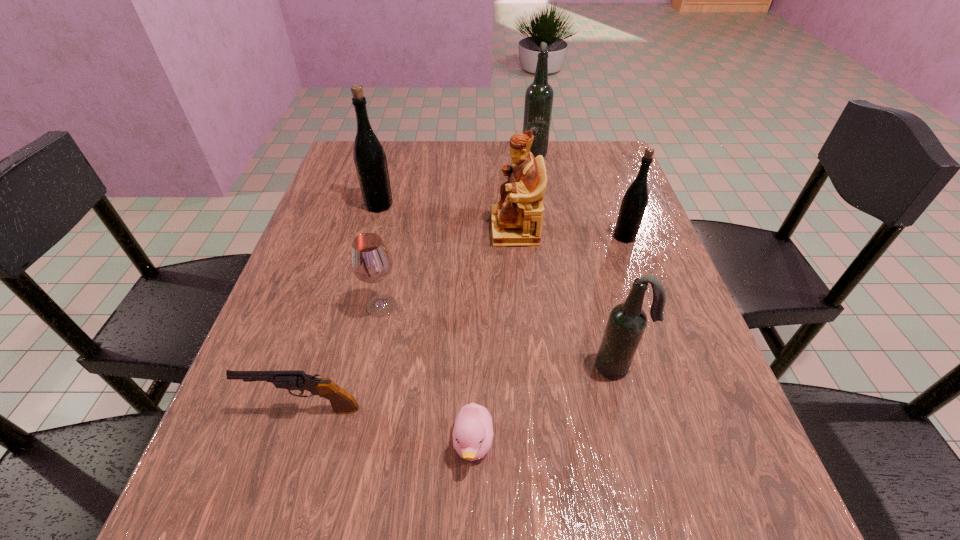
In order to click on vacant point located on the front of the rightmost beer bottle in this screenshot , I will do `click(653, 315)`.

Find the location of a particular element. Image resolution: width=960 pixels, height=540 pixels. vacant space situated on the left of the smaller dark beer bottle is located at coordinates (549, 367).

The height and width of the screenshot is (540, 960). Identify the location of free location located on the back of the fifth farthest object. (388, 275).

Locate an element on the screen. The image size is (960, 540). object located at the far edge is located at coordinates (539, 95).

Where is `beer bottle that is positioned at the left edge`? This screenshot has width=960, height=540. beer bottle that is positioned at the left edge is located at coordinates (369, 156).

Image resolution: width=960 pixels, height=540 pixels. Find the location of `gun at the left edge`. gun at the left edge is located at coordinates (342, 402).

Find the location of a particular element. The image size is (960, 540). vacant space at the far edge is located at coordinates (420, 159).

Where is `vacant area at the left edge`? This screenshot has height=540, width=960. vacant area at the left edge is located at coordinates (325, 370).

In the image, there is a desktop. Identify the location of vacant space at the right edge. The height and width of the screenshot is (540, 960). (675, 334).

Where is `blank area at the far right corner`? This screenshot has width=960, height=540. blank area at the far right corner is located at coordinates (611, 156).